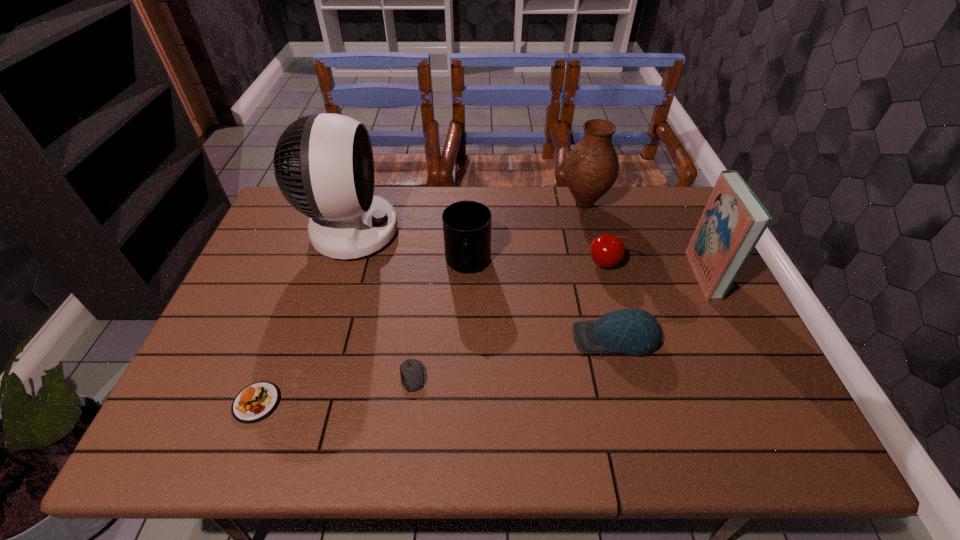
Image resolution: width=960 pixels, height=540 pixels. What are the coordinates of `vacant space in between the computer equipment and the sixth tallest object` in the screenshot? It's located at (514, 357).

Where is `vacant space in between the patty (food) and the fourth shortest object`? vacant space in between the patty (food) and the fourth shortest object is located at coordinates (431, 333).

This screenshot has height=540, width=960. Find the location of `free space between the fourth object from left to right and the hardback book`. free space between the fourth object from left to right and the hardback book is located at coordinates (586, 269).

Select which object is the closest to the fan. Please provide its 2D coordinates. Your answer should be formatted as a tuple, i.e. [(x, y)], where the tuple contains the x and y coordinates of a point satisfying the conditions above.

[(466, 224)]

Find the location of `object that can be found as the second closest to the patty (food)`. object that can be found as the second closest to the patty (food) is located at coordinates (324, 166).

The image size is (960, 540). I want to click on free space in the image that satisfies the following two spatial constraints: 1. on the back side of the patty (food); 2. on the right side of the fourth shortest object, so click(x=310, y=264).

Where is `free point that satisfies the following two spatial constraints: 1. on the grille of the tallest object; 2. on the right side of the computer equipment`? free point that satisfies the following two spatial constraints: 1. on the grille of the tallest object; 2. on the right side of the computer equipment is located at coordinates (305, 376).